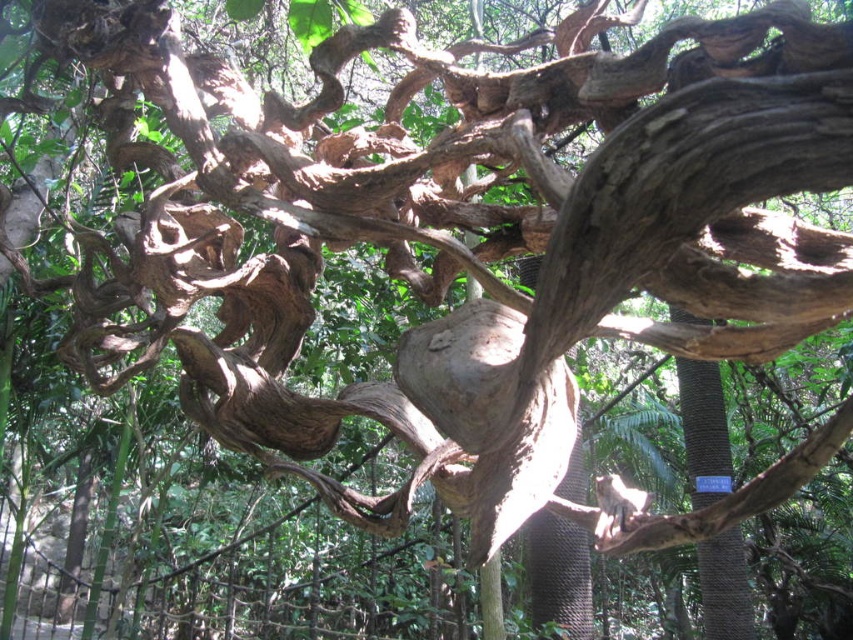
Question: Which point is farther to the camera?

Choices:
 (A) (584, 625)
 (B) (701, 608)

Answer: (B)

Question: Considering the relative positions of smooth brown bark at center and brown rough textured tree trunk at center in the image provided, where is smooth brown bark at center located with respect to brown rough textured tree trunk at center?

Choices:
 (A) above
 (B) below

Answer: (A)

Question: Is smooth brown bark at center positioned at the back of brown rough textured tree trunk at center?

Choices:
 (A) no
 (B) yes

Answer: (B)

Question: Which point is farther to the camera?

Choices:
 (A) brown rough textured tree trunk at center
 (B) smooth brown bark at center

Answer: (B)

Question: Which point is farther to the camera?

Choices:
 (A) smooth brown bark at center
 (B) brown rough textured tree trunk at center

Answer: (A)

Question: Can you confirm if smooth brown bark at center is bigger than brown rough textured tree trunk at center?

Choices:
 (A) no
 (B) yes

Answer: (B)